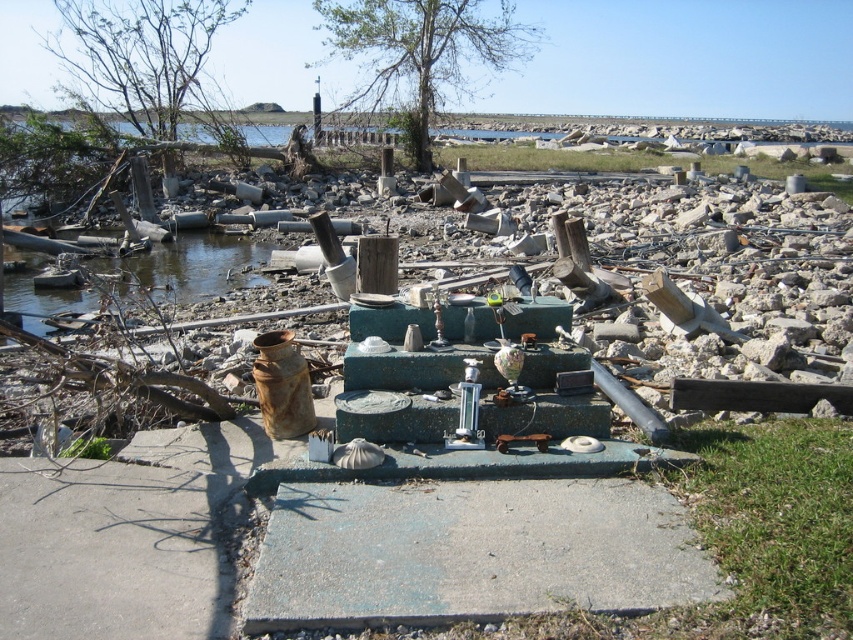
Does point (303, 557) lie in front of point (178, 248)?

Yes, it is in front of point (178, 248).

Is gray concrete slab at center bigger than clear water at left?

Correct, gray concrete slab at center is larger in size than clear water at left.

The image size is (853, 640). Describe the element at coordinates (471, 552) in the screenshot. I see `gray concrete slab at center` at that location.

What are the coordinates of `gray concrete slab at center` in the screenshot? It's located at (471, 552).